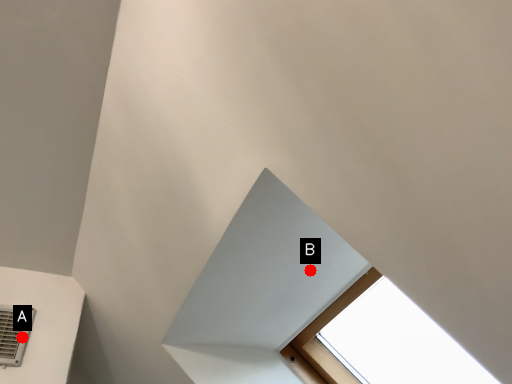
Question: Two points are circled on the image, labeled by A and B beside each circle. Which of the following is the farthest from the observer?

Choices:
 (A) A is further
 (B) B is further

Answer: (A)